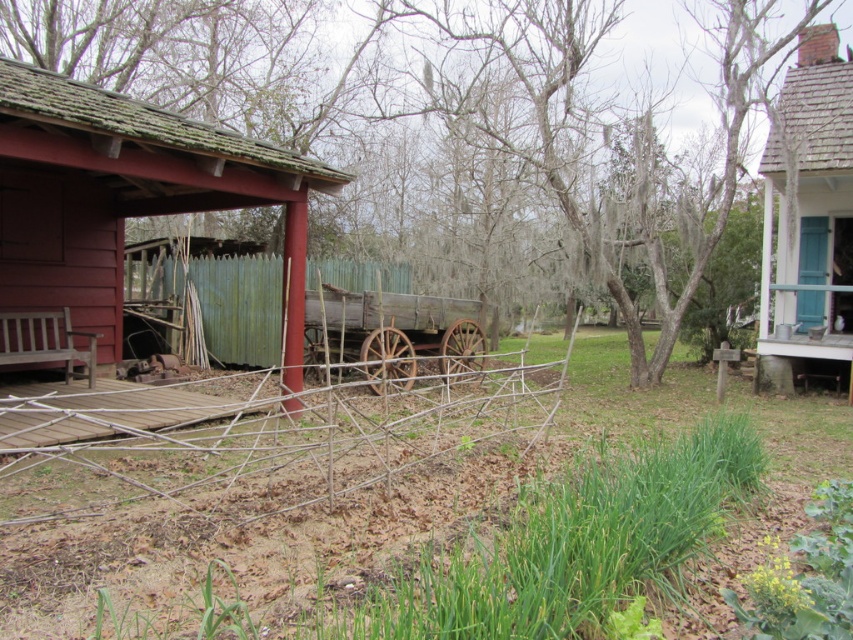
Question: Which of the following is the farthest from the observer?

Choices:
 (A) (38, 604)
 (B) (796, 104)
 (C) (49, 128)

Answer: (B)

Question: Considering the relative positions of wooden cabin at upper right and rusty wood wagon at center in the image provided, where is wooden cabin at upper right located with respect to rusty wood wagon at center?

Choices:
 (A) above
 (B) below

Answer: (A)

Question: Which point is farther to the camera?

Choices:
 (A) wooden cabin at upper right
 (B) wooden fence at center

Answer: (A)

Question: Does wooden fence at center appear under matte red wooden hut at left?

Choices:
 (A) yes
 (B) no

Answer: (A)

Question: Which point is farther to the camera?

Choices:
 (A) rusty wood wagon at center
 (B) green corrugated metal fence at center
 (C) matte red wooden hut at left

Answer: (B)

Question: Where is wooden cabin at upper right located in relation to green corrugated metal fence at center in the image?

Choices:
 (A) below
 (B) above

Answer: (B)